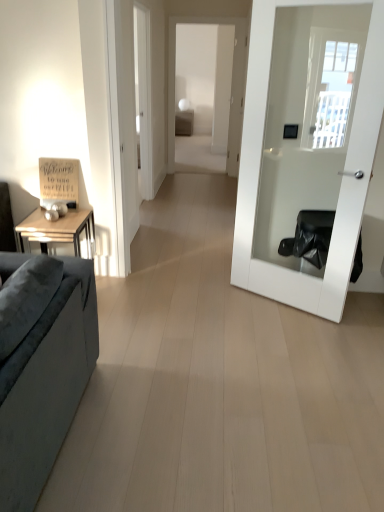
Question: In terms of width, does matte brown table at center look wider or thinner when compared to white glossy door at right?

Choices:
 (A) wide
 (B) thin

Answer: (A)

Question: From a real-world perspective, is matte brown table at center above or below white glossy door at right?

Choices:
 (A) above
 (B) below

Answer: (B)

Question: Which object is the farthest from the white glossy door at right?

Choices:
 (A) suede-like gray couch at left
 (B) matte brown table at center

Answer: (B)

Question: Estimate the real-world distances between objects in this image. Which object is closer to the suede-like gray couch at left?

Choices:
 (A) matte brown table at center
 (B) white glossy door at right

Answer: (B)